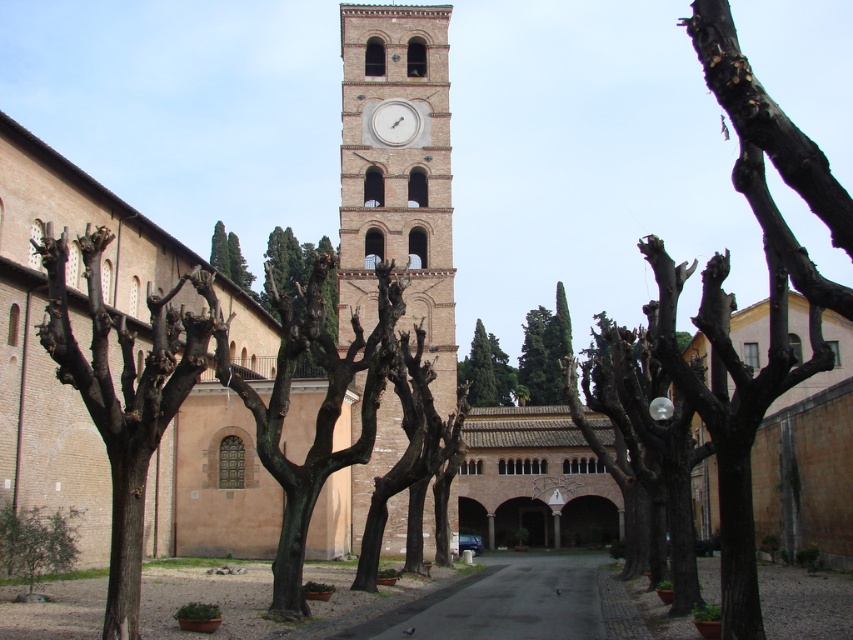
You are standing at the entrance of the courtyard and want to take a photo of both the green leafy tree at lower left and the white glossy clock at center. Which object should you position closer to the camera to ensure both are in frame?

Since the green leafy tree at lower left is not as tall as the white glossy clock at center, you should position the green leafy tree at lower left closer to the camera to balance their sizes in the photo.

You are standing in the courtyard and want to take a photo of both the brick clock tower at center and the bare wood tree at left. Which object should you focus on first to ensure both are in the frame?

You should focus on the brick clock tower at center first because it is closer to you than the bare wood tree at left, so adjusting the camera to include it will also capture the tree in the background.